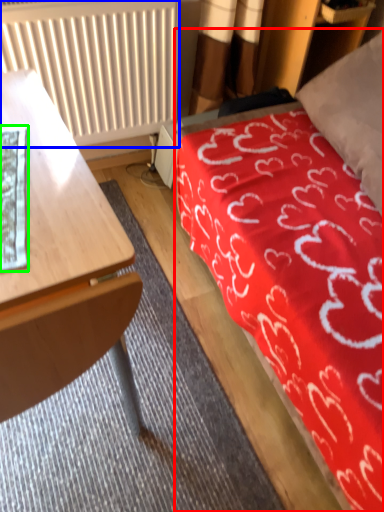
Question: Which object is the farthest from bed (highlighted by a red box)? Choose among these: radiator (highlighted by a blue box) or sheet (highlighted by a green box).

Choices:
 (A) radiator
 (B) sheet

Answer: (B)